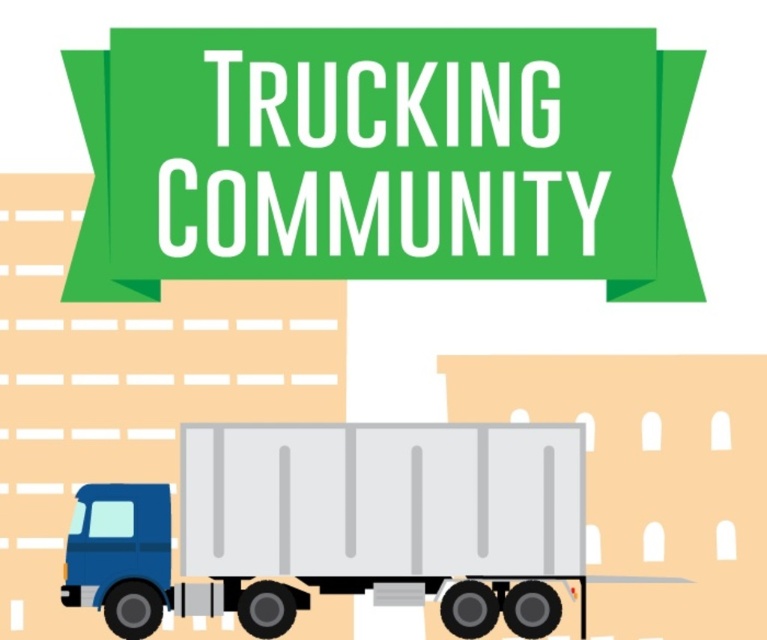
Question: Is green fabric banner at upper center bigger than matte gray trailer truck at lower left?

Choices:
 (A) no
 (B) yes

Answer: (A)

Question: Which object is farther from the camera taking this photo?

Choices:
 (A) green fabric banner at upper center
 (B) matte gray trailer truck at lower left

Answer: (B)

Question: Is green fabric banner at upper center smaller than matte gray trailer truck at lower left?

Choices:
 (A) no
 (B) yes

Answer: (B)

Question: Which point is closer to the camera?

Choices:
 (A) (78, 563)
 (B) (336, 48)

Answer: (B)

Question: Which of the following is the farthest from the observer?

Choices:
 (A) green fabric banner at upper center
 (B) matte gray trailer truck at lower left

Answer: (B)

Question: Is green fabric banner at upper center closer to camera compared to matte gray trailer truck at lower left?

Choices:
 (A) yes
 (B) no

Answer: (A)